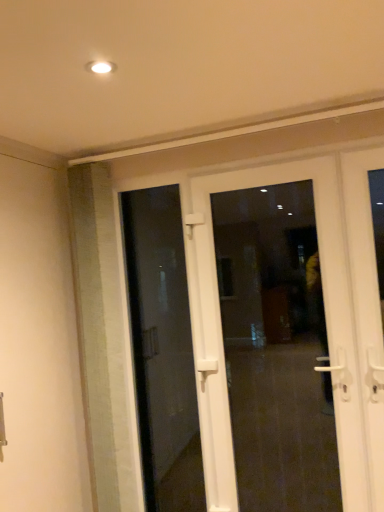
Question: From the image's perspective, is transparent glass door at center, the second door viewed from the front, positioned above or below white plastic door at center, which is the second door in back-to-front order?

Choices:
 (A) below
 (B) above

Answer: (B)

Question: Looking at the image, does transparent glass door at center, the second door viewed from the front, seem bigger or smaller compared to white plastic door at center, which is the second door in back-to-front order?

Choices:
 (A) big
 (B) small

Answer: (B)

Question: Is transparent glass door at center, the second door viewed from the front, in front of or behind white plastic door at center, the 1th door positioned from the front, in the image?

Choices:
 (A) behind
 (B) front

Answer: (A)

Question: Considering the positions of point (210, 251) and point (193, 497), is point (210, 251) closer or farther from the camera than point (193, 497)?

Choices:
 (A) closer
 (B) farther

Answer: (A)

Question: From a real-world perspective, relative to transparent glass door at center, the 1th door when ordered from back to front, is white plastic door at center, which is the second door in back-to-front order, vertically above or below?

Choices:
 (A) below
 (B) above

Answer: (A)

Question: Choose the correct answer: Is white plastic door at center, the 1th door positioned from the front, inside transparent glass door at center, the second door viewed from the front, or outside it?

Choices:
 (A) inside
 (B) outside

Answer: (B)

Question: Is white plastic door at center, the 1th door positioned from the front, bigger or smaller than transparent glass door at center, the second door viewed from the front?

Choices:
 (A) big
 (B) small

Answer: (A)